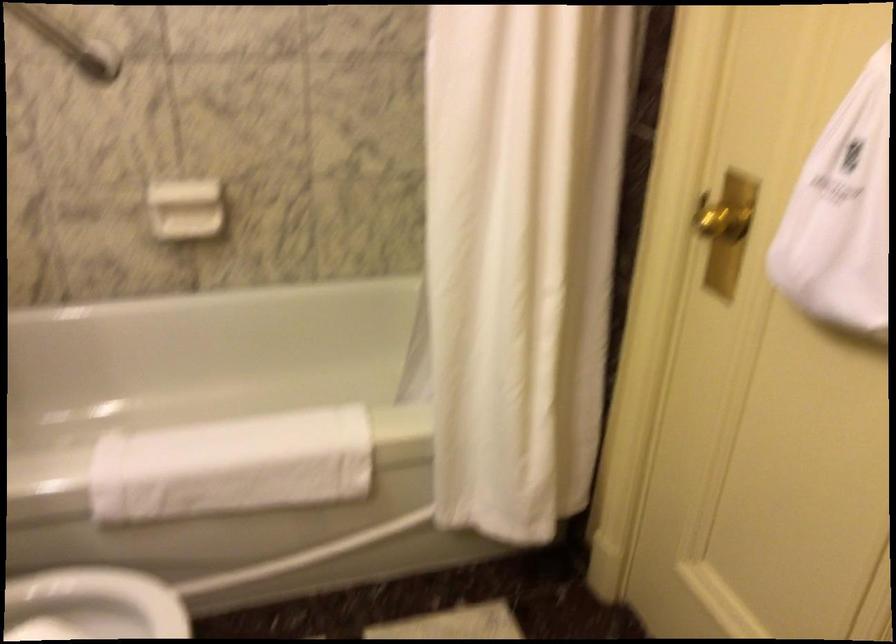
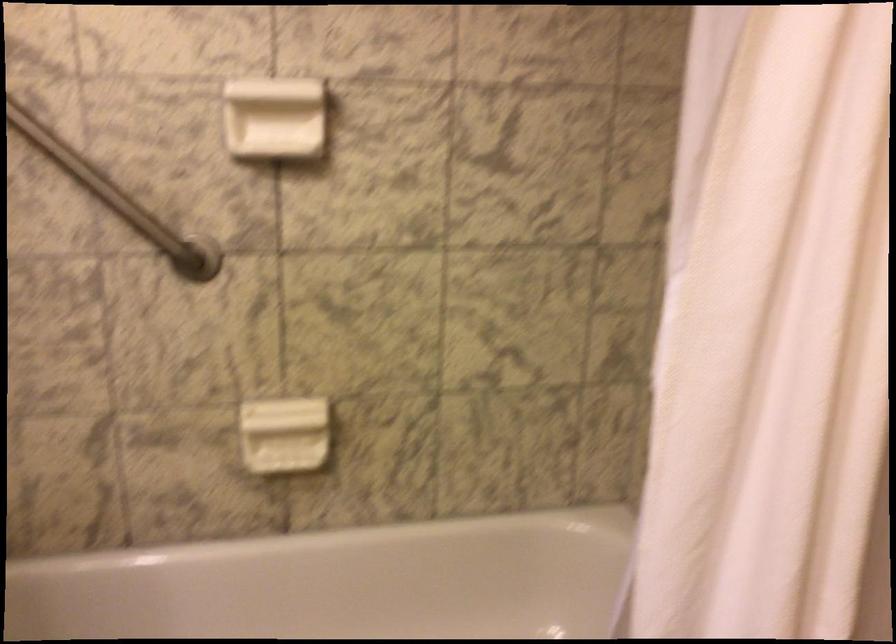
The images are taken continuously from a first-person perspective. In which direction are you moving?

The movement direction of the cameraman is left, forward.